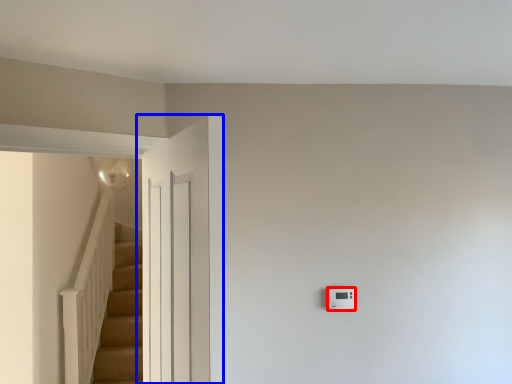
Question: Which of the following is the closest to the observer, light switch (highlighted by a red box) or door (highlighted by a blue box)?

Choices:
 (A) light switch
 (B) door

Answer: (B)